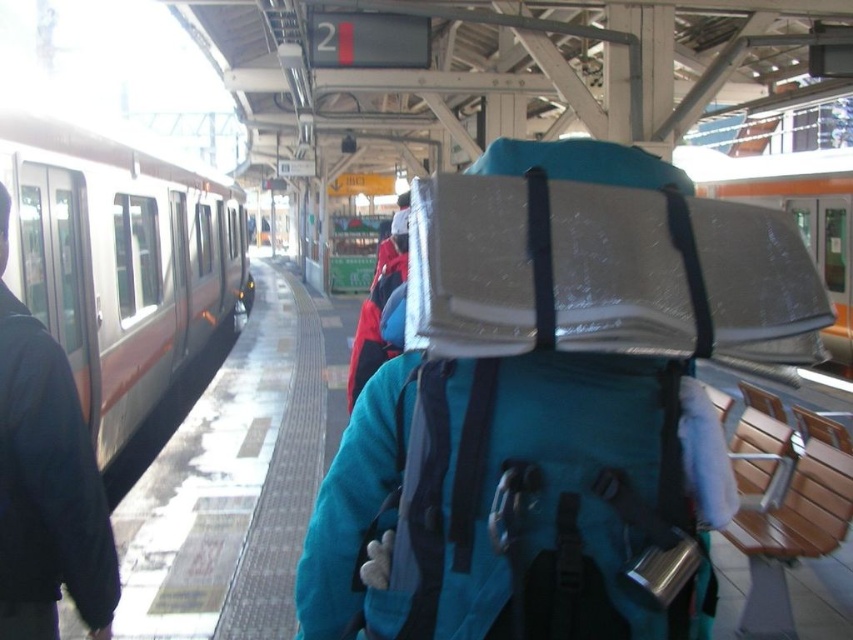
Is silver metallic train at left bigger than dark blue fabric jacket at left?

Correct, silver metallic train at left is larger in size than dark blue fabric jacket at left.

Is silver metallic train at left to the left of dark blue fabric jacket at left from the viewer's perspective?

Yes, silver metallic train at left is to the left of dark blue fabric jacket at left.

Does point (64, 298) come in front of point (68, 390)?

No, (64, 298) is further to viewer.

The width and height of the screenshot is (853, 640). I want to click on silver metallic train at left, so click(119, 257).

Does silver metallic train at left appear on the right side of metallic silver train at right?

No, silver metallic train at left is not to the right of metallic silver train at right.

Is silver metallic train at left above metallic silver train at right?

No.

Between point (129, 221) and point (848, 275), which one is positioned in front?

Point (129, 221) is more forward.

I want to click on silver metallic train at left, so click(119, 257).

Which is below, dark blue fabric jacket at left or metallic silver train at right?

dark blue fabric jacket at left is lower down.

Who is shorter, dark blue fabric jacket at left or metallic silver train at right?

dark blue fabric jacket at left is shorter.

Locate an element on the screen. This screenshot has width=853, height=640. dark blue fabric jacket at left is located at coordinates (45, 483).